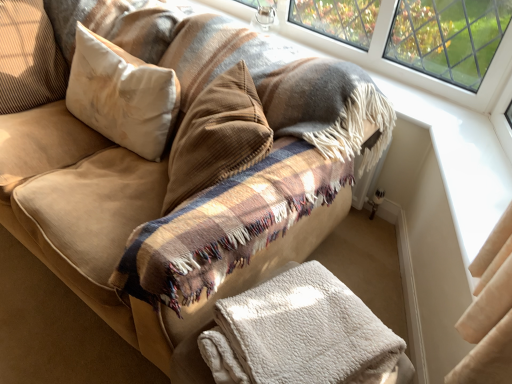
Question: Is white fluffy blanket at lower center facing towards white soft pillow at upper left, acting as the 2th pillow starting from the left?

Choices:
 (A) no
 (B) yes

Answer: (A)

Question: Is white fluffy blanket at lower center looking in the opposite direction of white soft pillow at upper left, the first pillow positioned from the right?

Choices:
 (A) no
 (B) yes

Answer: (A)

Question: Considering the relative sizes of white fluffy blanket at lower center and white soft pillow at upper left, acting as the 2th pillow starting from the left, in the image provided, is white fluffy blanket at lower center smaller than white soft pillow at upper left, acting as the 2th pillow starting from the left,?

Choices:
 (A) no
 (B) yes

Answer: (B)

Question: Are white fluffy blanket at lower center and white soft pillow at upper left, acting as the 2th pillow starting from the left, located far from each other?

Choices:
 (A) no
 (B) yes

Answer: (A)

Question: Considering the relative sizes of white fluffy blanket at lower center and white soft pillow at upper left, acting as the 2th pillow starting from the left, in the image provided, is white fluffy blanket at lower center bigger than white soft pillow at upper left, acting as the 2th pillow starting from the left,?

Choices:
 (A) no
 (B) yes

Answer: (A)

Question: Considering the relative sizes of white fluffy blanket at lower center and white soft pillow at upper left, acting as the 2th pillow starting from the left, in the image provided, is white fluffy blanket at lower center thinner than white soft pillow at upper left, acting as the 2th pillow starting from the left,?

Choices:
 (A) yes
 (B) no

Answer: (B)

Question: Does white soft pillow at upper left, the first pillow positioned from the right, contain suede-like beige pillow at upper left, which ranks as the 1th pillow in left-to-right order?

Choices:
 (A) yes
 (B) no

Answer: (B)

Question: Is white soft pillow at upper left, acting as the 2th pillow starting from the left, directly adjacent to suede-like beige pillow at upper left, which ranks as the 1th pillow in left-to-right order?

Choices:
 (A) yes
 (B) no

Answer: (B)

Question: Considering the relative positions of white soft pillow at upper left, acting as the 2th pillow starting from the left, and suede-like beige pillow at upper left, which ranks as the 1th pillow in left-to-right order, in the image provided, is white soft pillow at upper left, acting as the 2th pillow starting from the left, behind suede-like beige pillow at upper left, which ranks as the 1th pillow in left-to-right order,?

Choices:
 (A) no
 (B) yes

Answer: (A)

Question: Does white soft pillow at upper left, acting as the 2th pillow starting from the left, have a greater width compared to suede-like beige pillow at upper left, marked as the second pillow in a right-to-left arrangement?

Choices:
 (A) yes
 (B) no

Answer: (B)

Question: Does white soft pillow at upper left, acting as the 2th pillow starting from the left, have a lesser height compared to suede-like beige pillow at upper left, marked as the second pillow in a right-to-left arrangement?

Choices:
 (A) yes
 (B) no

Answer: (A)

Question: Could you tell me if white soft pillow at upper left, the first pillow positioned from the right, is facing suede-like beige pillow at upper left, marked as the second pillow in a right-to-left arrangement?

Choices:
 (A) yes
 (B) no

Answer: (B)

Question: Is suede-like beige pillow at upper left, which ranks as the 1th pillow in left-to-right order, at the back of white fluffy blanket at lower center?

Choices:
 (A) no
 (B) yes

Answer: (A)